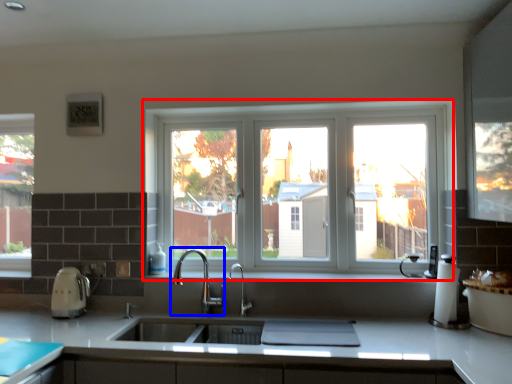
Question: Which of the following is the farthest to the observer, window (highlighted by a red box) or tap (highlighted by a blue box)?

Choices:
 (A) window
 (B) tap

Answer: (A)